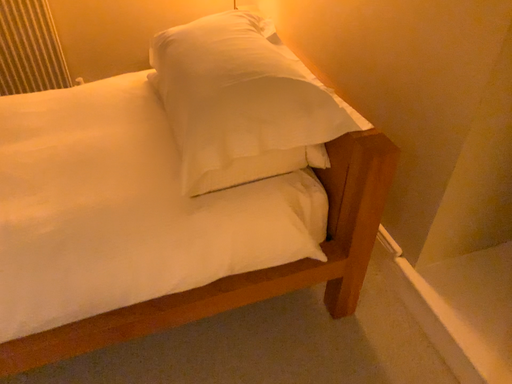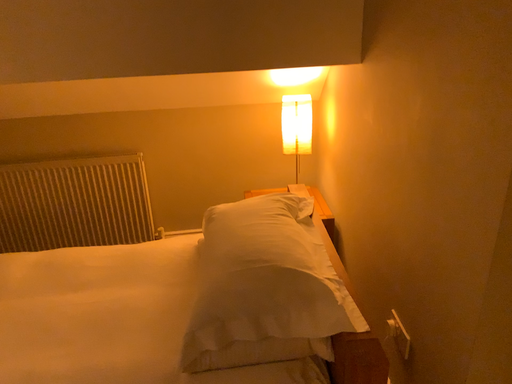
Question: How did the camera likely rotate when shooting the video?

Choices:
 (A) rotated downward
 (B) rotated upward

Answer: (B)